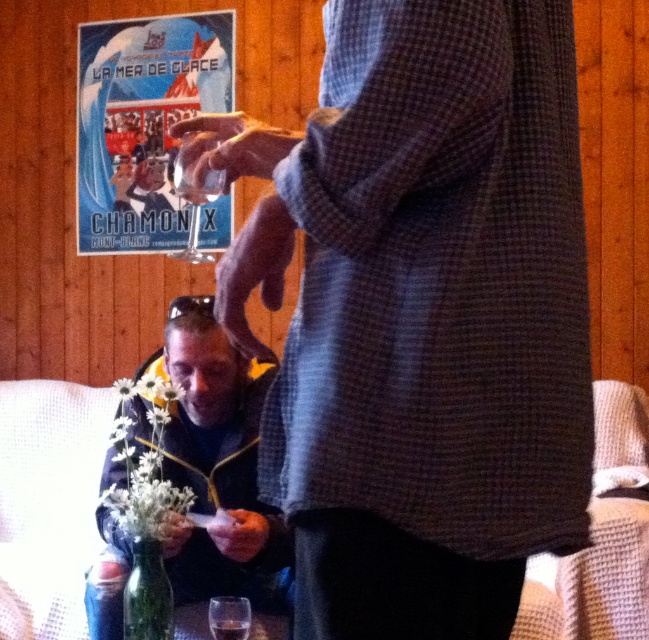
Question: Is clear glass wine glass at center below transparent glass at upper center?

Choices:
 (A) yes
 (B) no

Answer: (B)

Question: Which point is farther from the camera taking this photo?

Choices:
 (A) (188, 241)
 (B) (478, 193)

Answer: (A)

Question: Observing the image, what is the correct spatial positioning of matte paper poster at upper left in reference to clear glass wine glass at center?

Choices:
 (A) right
 (B) left

Answer: (B)

Question: Based on their relative distances, which object is nearer to the clear glass wine glass at center?

Choices:
 (A) dark blue jacket at lower left
 (B) matte paper poster at upper left
 (C) transparent glass at lower center
 (D) translucent glass at lower center

Answer: (B)

Question: Estimate the real-world distances between objects in this image. Which object is farther from the translucent glass at lower center?

Choices:
 (A) clear glass wine glass at center
 (B) matte paper poster at upper left
 (C) checkered fabric shirt at center
 (D) transparent glass at lower center

Answer: (B)

Question: Is transparent glass at lower center thinner than translucent glass at lower center?

Choices:
 (A) yes
 (B) no

Answer: (B)